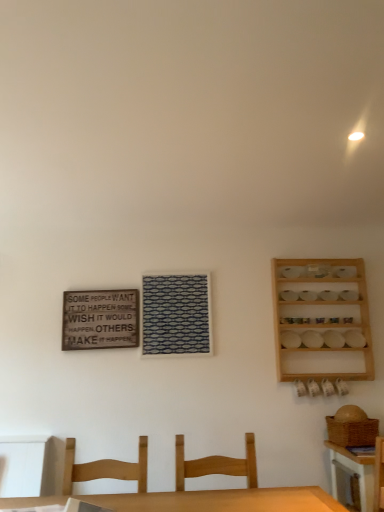
Question: From a real-world perspective, is wooden spice rack at right positioned over light brown wood chair at lower center, placed as the second chair when sorted from right to left, based on gravity?

Choices:
 (A) yes
 (B) no

Answer: (A)

Question: Would you say wooden spice rack at right contains light brown wood chair at lower center, placed as the second chair when sorted from right to left?

Choices:
 (A) no
 (B) yes

Answer: (A)

Question: Is wooden spice rack at right not within light brown wood chair at lower center, the first chair positioned from the left?

Choices:
 (A) no
 (B) yes

Answer: (B)

Question: From the image's perspective, is wooden spice rack at right over light brown wood chair at lower center, placed as the second chair when sorted from right to left?

Choices:
 (A) yes
 (B) no

Answer: (A)

Question: Considering the relative sizes of wooden spice rack at right and light brown wood chair at lower center, the first chair positioned from the left, in the image provided, is wooden spice rack at right thinner than light brown wood chair at lower center, the first chair positioned from the left,?

Choices:
 (A) yes
 (B) no

Answer: (A)

Question: From the image's perspective, is wooden table at lower right above or below wooden signboard at upper left?

Choices:
 (A) below
 (B) above

Answer: (A)

Question: Is wooden table at lower right situated inside wooden signboard at upper left or outside?

Choices:
 (A) outside
 (B) inside

Answer: (A)

Question: From a real-world perspective, is wooden table at lower right physically located above or below wooden signboard at upper left?

Choices:
 (A) above
 (B) below

Answer: (B)

Question: Considering the positions of wooden table at lower right and wooden signboard at upper left in the image, is wooden table at lower right taller or shorter than wooden signboard at upper left?

Choices:
 (A) short
 (B) tall

Answer: (B)

Question: From a real-world perspective, is light brown wood chair at lower center, placed as the second chair when sorted from right to left, positioned above or below wooden spice rack at right?

Choices:
 (A) above
 (B) below

Answer: (B)

Question: Looking at the image, does light brown wood chair at lower center, placed as the second chair when sorted from right to left, seem bigger or smaller compared to wooden spice rack at right?

Choices:
 (A) small
 (B) big

Answer: (B)

Question: From the image's perspective, is light brown wood chair at lower center, placed as the second chair when sorted from right to left, located above or below wooden spice rack at right?

Choices:
 (A) below
 (B) above

Answer: (A)

Question: Considering the positions of point (140, 449) and point (342, 261), is point (140, 449) closer or farther from the camera than point (342, 261)?

Choices:
 (A) closer
 (B) farther

Answer: (A)

Question: Is wooden signboard at upper left taller or shorter than wooden chair at center, positioned as the second chair in left-to-right order?

Choices:
 (A) short
 (B) tall

Answer: (B)

Question: Is point (99, 333) positioned closer to the camera than point (240, 475)?

Choices:
 (A) closer
 (B) farther

Answer: (B)